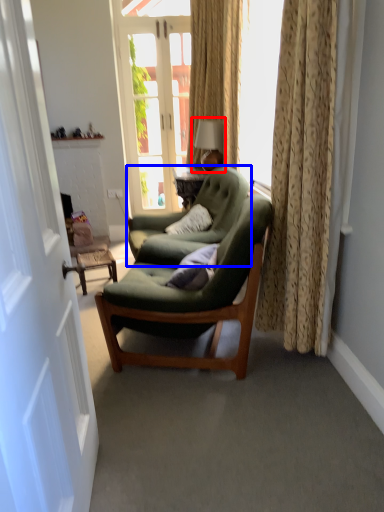
Question: Among these objects, which one is farthest to the camera, table lamp (highlighted by a red box) or chair (highlighted by a blue box)?

Choices:
 (A) table lamp
 (B) chair

Answer: (A)